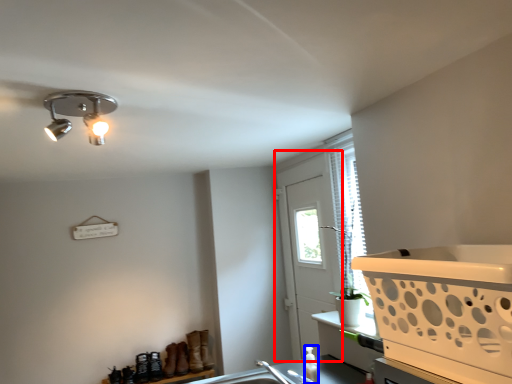
Question: Which of the following is the farthest to the observer, screen door (highlighted by a red box) or bottle (highlighted by a blue box)?

Choices:
 (A) screen door
 (B) bottle

Answer: (A)